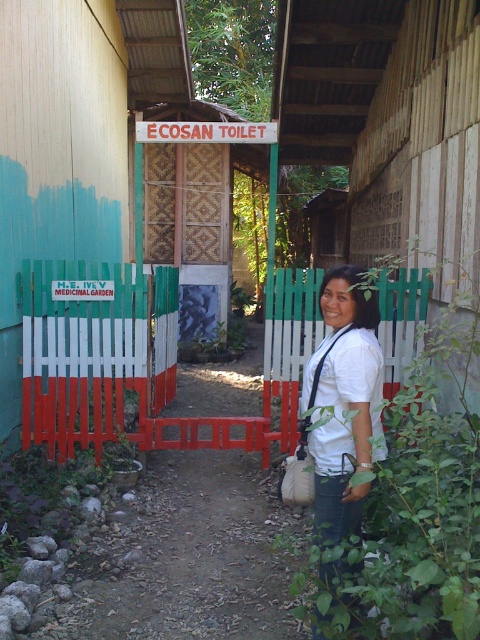
You are a painter who needs to paint both the green painted wood fence at center and the white matte shirt at center. Which object requires more paint considering their widths?

The green painted wood fence at center might be wider than the white matte shirt at center, so it likely requires more paint.